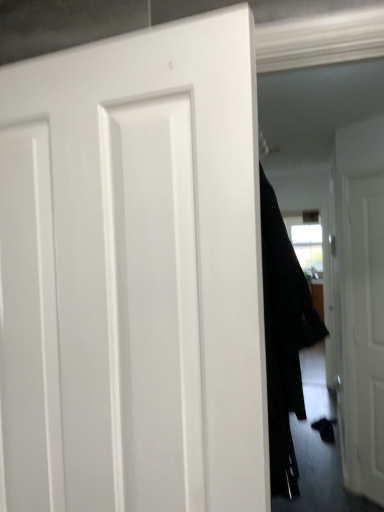
You are a GUI agent. You are given a task and a screenshot of the screen. Output one action in this format:
    pyautogui.click(x=<x>, y=<y>)
    Task: Click on the white matte door at center, the first door positioned from the front
    
    Given the screenshot: What is the action you would take?
    pyautogui.click(x=151, y=264)

Is point (378, 339) farther from viewer compared to point (233, 228)?

Yes, it is behind point (233, 228).

From the image's perspective, which is above, white matte door at right, positioned as the 1th door in back-to-front order, or white matte door at center, acting as the second door starting from the right?

white matte door at center, acting as the second door starting from the right, is shown above in the image.

From a real-world perspective, is white matte door at right, which is the 2th door from left to right, positioned above or below white matte door at center, the first door from the left?

Clearly, from a real-world perspective, white matte door at right, which is the 2th door from left to right, is below white matte door at center, the first door from the left.

Based on the photo, can you tell me how much white matte door at right, the 2th door in the front-to-back sequence, and black fabric coat at center differ in facing direction?

The facing directions of white matte door at right, the 2th door in the front-to-back sequence, and black fabric coat at center are 136 degrees apart.

Are white matte door at right, positioned as the 1th door in back-to-front order, and black fabric coat at center making contact?

No, white matte door at right, positioned as the 1th door in back-to-front order, is not touching black fabric coat at center.

Could you tell me if white matte door at right, the 2th door in the front-to-back sequence, is turned towards black fabric coat at center?

No, white matte door at right, the 2th door in the front-to-back sequence, is not turned towards black fabric coat at center.

Is point (269, 426) farther from camera compared to point (366, 302)?

No, it is not.

Does black fabric coat at center have a smaller size compared to white matte door at right, the 2th door in the front-to-back sequence?

No, black fabric coat at center is not smaller than white matte door at right, the 2th door in the front-to-back sequence.

Is black fabric coat at center not close to white matte door at right, which is the 2th door from left to right?

Indeed, black fabric coat at center is not near white matte door at right, which is the 2th door from left to right.

Looking at their sizes, would you say white matte door at center, the first door positioned from the front, is wider or thinner than black fabric coat at center?

white matte door at center, the first door positioned from the front, is thinner than black fabric coat at center.

Is white matte door at center, marked as the 2th door in a back-to-front arrangement, smaller than black fabric coat at center?

Correct, white matte door at center, marked as the 2th door in a back-to-front arrangement, occupies less space than black fabric coat at center.

Which is more to the right, white matte door at center, marked as the 2th door in a back-to-front arrangement, or black fabric coat at center?

From the viewer's perspective, black fabric coat at center appears more on the right side.

Is point (219, 263) in front of point (314, 326)?

Yes, point (219, 263) is closer to viewer.

From a real-world perspective, who is located lower, black fabric coat at center or white matte door at center, the first door from the left?

From a 3D spatial view, black fabric coat at center is below.

From the image's perspective, which object appears higher, black fabric coat at center or white matte door at center, the first door from the left?

white matte door at center, the first door from the left, is shown above in the image.

Which is correct: black fabric coat at center is inside white matte door at center, marked as the 2th door in a back-to-front arrangement, or outside of it?

black fabric coat at center cannot be found inside white matte door at center, marked as the 2th door in a back-to-front arrangement.

Which is in front, point (279, 390) or point (89, 394)?

Point (89, 394)

Is white matte door at center, the first door from the left, inside the boundaries of white matte door at right, positioned as the 1th door in back-to-front order, or outside?

white matte door at center, the first door from the left, is not enclosed by white matte door at right, positioned as the 1th door in back-to-front order.

From the picture: Considering the relative sizes of white matte door at center, the first door positioned from the front, and white matte door at right, positioned as the 1th door in back-to-front order, in the image provided, is white matte door at center, the first door positioned from the front, shorter than white matte door at right, positioned as the 1th door in back-to-front order,?

Yes.

From a real-world perspective, which object rests below the other?

white matte door at right, positioned as the 1th door in back-to-front order.

I want to click on door on the right of white matte door at center, acting as the second door starting from the right, so click(x=360, y=303).

The height and width of the screenshot is (512, 384). In the image, there is a black fabric coat at center. What are the coordinates of `door below it (from the image's perspective)` in the screenshot? It's located at (360, 303).

From the picture: Estimate the real-world distances between objects in this image. Which object is further from white matte door at center, the first door positioned from the front, white matte door at right, positioned as the 1th door in back-to-front order, or black fabric coat at center?

Based on the image, white matte door at right, positioned as the 1th door in back-to-front order, appears to be further to white matte door at center, the first door positioned from the front.

Based on the photo, from the image, which object appears to be nearer to black fabric coat at center, white matte door at right, positioned as the 1th door in back-to-front order, or white matte door at center, marked as the 2th door in a back-to-front arrangement?

white matte door at center, marked as the 2th door in a back-to-front arrangement, is closer to black fabric coat at center.

From the picture: Estimate the real-world distances between objects in this image. Which object is closer to white matte door at right, the 1th door in the right-to-left sequence, black fabric coat at center or white matte door at center, acting as the second door starting from the right?

black fabric coat at center is positioned closer to the anchor white matte door at right, the 1th door in the right-to-left sequence.

Looking at the image, which one is located closer to white matte door at right, the 2th door in the front-to-back sequence, white matte door at center, the first door positioned from the front, or black fabric coat at center?

black fabric coat at center is positioned closer to the anchor white matte door at right, the 2th door in the front-to-back sequence.

Consider the image. Estimate the real-world distances between objects in this image. Which object is further from white matte door at center, acting as the second door starting from the right, black fabric coat at center or white matte door at right, the 1th door in the right-to-left sequence?

white matte door at right, the 1th door in the right-to-left sequence, lies further to white matte door at center, acting as the second door starting from the right, than the other object.

Looking at this image, which object lies nearer to the anchor point black fabric coat at center, white matte door at center, the first door positioned from the front, or white matte door at right, positioned as the 1th door in back-to-front order?

white matte door at center, the first door positioned from the front, is closer to black fabric coat at center.

You are a GUI agent. You are given a task and a screenshot of the screen. Output one action in this format:
    pyautogui.click(x=<x>, y=<y>)
    Task: Click on the garment positioned between white matte door at center, acting as the second door starting from the right, and white matte door at right, positioned as the 1th door in back-to-front order, from near to far
    
    Given the screenshot: What is the action you would take?
    pyautogui.click(x=284, y=339)